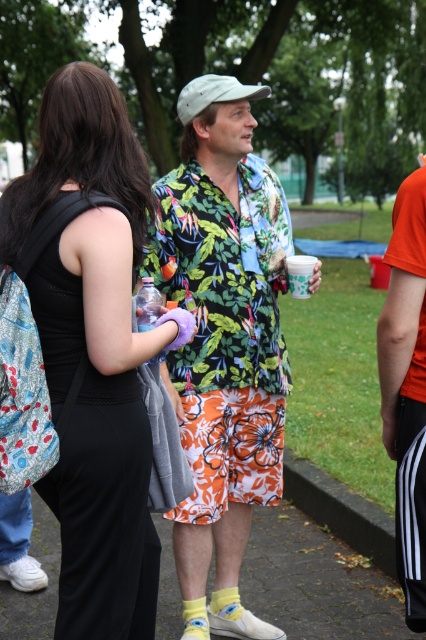
Based on the coordinates provided, which object is located at point (x=94, y=353)?

The point (x=94, y=353) corresponds to the black fabric dress at center.

You are standing in a park and see a black fabric dress at center. If you want to hand something to the person wearing it without moving closer, what is the maximum distance you can stay while still reaching them?

The black fabric dress at center is 2.67 meters away from the viewer. To hand something without moving closer, you must stay within 2.67 meters.

You are a photographer trying to capture a candid shot of the black fabric dress at center and the light gray fabric baseball cap at upper center. Which object should you focus on first if you want to include both in your frame without moving your camera?

The black fabric dress at center is positioned on the left side of light gray fabric baseball cap at upper center, so you should focus on the black fabric dress at center first to ensure both are in frame without moving the camera.